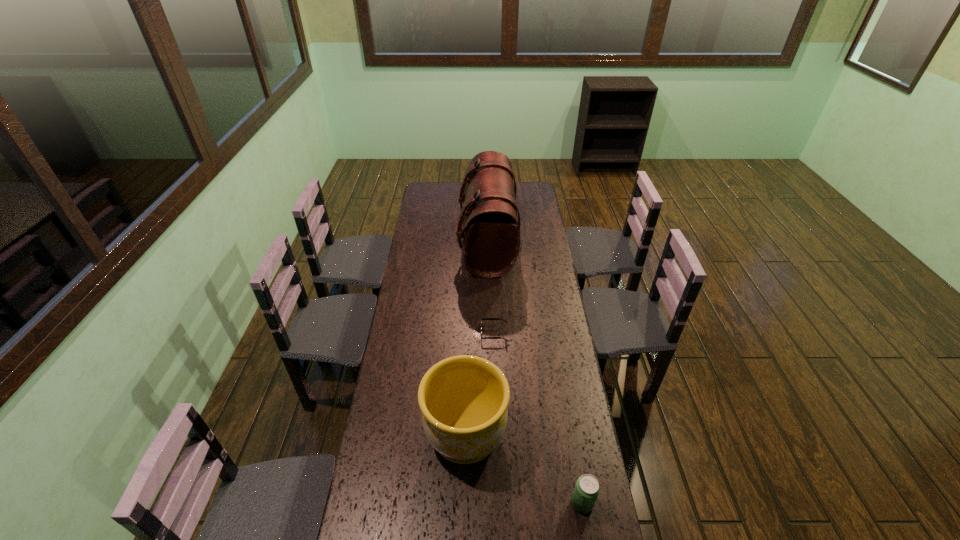
Identify the location of satchel. The height and width of the screenshot is (540, 960). (491, 242).

Find the location of a particular element. This screenshot has width=960, height=540. the tallest object is located at coordinates (491, 242).

Image resolution: width=960 pixels, height=540 pixels. Identify the location of flowerpot. (463, 399).

Find the location of a particular element. Image resolution: width=960 pixels, height=540 pixels. the second nearest object is located at coordinates (463, 399).

This screenshot has width=960, height=540. I want to click on the third tallest object, so (587, 488).

Identify the location of the rightmost object. Image resolution: width=960 pixels, height=540 pixels. (587, 488).

The width and height of the screenshot is (960, 540). In order to click on the shortest object in this screenshot , I will do `click(481, 318)`.

The image size is (960, 540). Identify the location of sunglasses. (481, 318).

Find the location of a particular element. This screenshot has width=960, height=540. free space located on the front-facing side of the tallest object is located at coordinates (413, 244).

Find the location of a particular element. The width and height of the screenshot is (960, 540). free region located on the front-facing side of the tallest object is located at coordinates (419, 244).